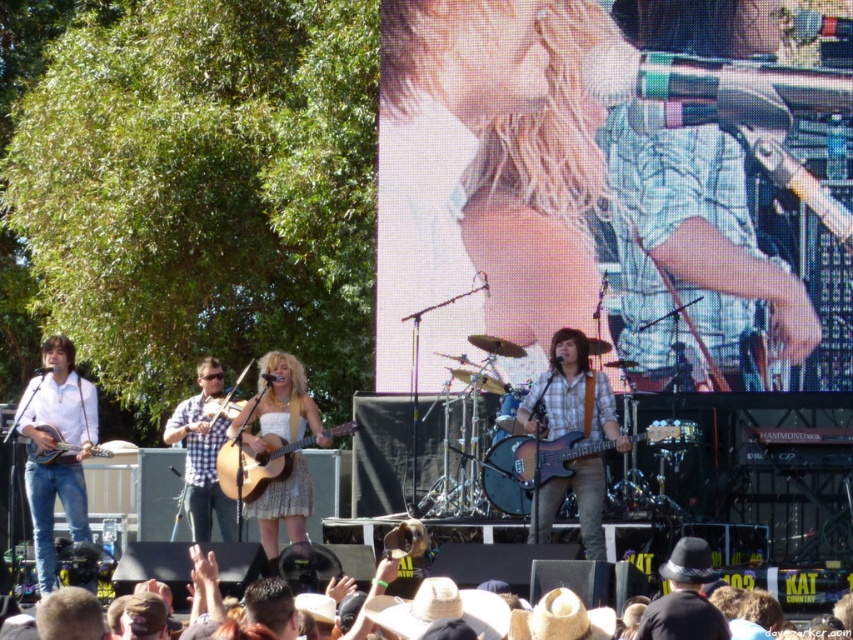
Question: Which of the following is the farthest from the observer?

Choices:
 (A) (637, 586)
 (B) (262, 380)
 (C) (595, 484)
 (D) (711, 604)

Answer: (B)

Question: Estimate the real-world distances between objects in this image. Which object is farther from the black felt hat at lower center?

Choices:
 (A) wooden acoustic guitar at center
 (B) plaid fabric guitar at center
 (C) glossy wood guitar at center

Answer: (A)

Question: Is white lace dress at center below black felt hat at lower center?

Choices:
 (A) yes
 (B) no

Answer: (B)

Question: Does glossy wood guitar at center come in front of matte brown acoustic guitar at lower left?

Choices:
 (A) yes
 (B) no

Answer: (A)

Question: Considering the real-world distances, which object is closest to the checkered fabric guitar at center?

Choices:
 (A) black felt hat at lower center
 (B) plaid fabric guitar at center

Answer: (B)

Question: Is white lace dress at center thinner than wooden acoustic guitar at center?

Choices:
 (A) yes
 (B) no

Answer: (A)